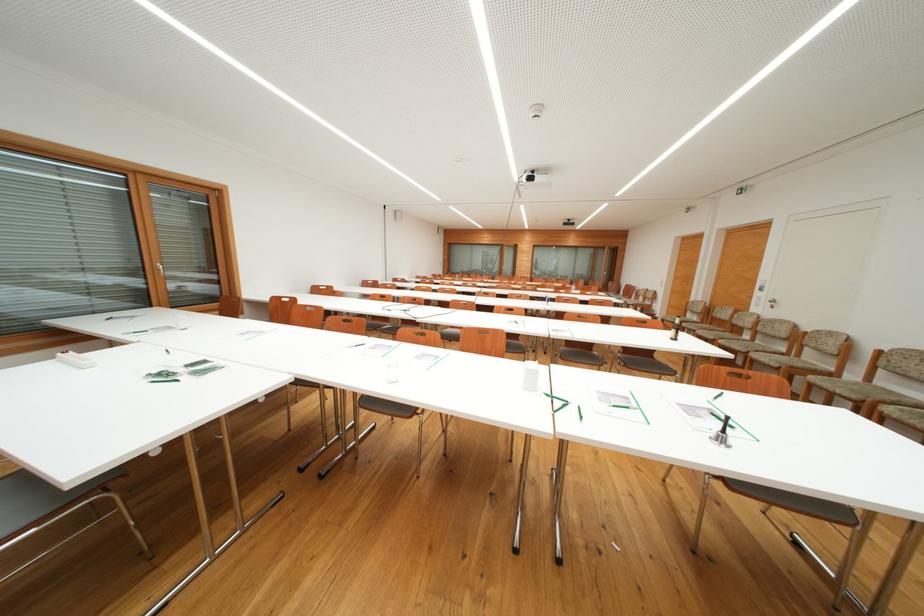
Where would you lift the white remote control? Please return your answer as a coordinate pair (x, y).

(75, 359)